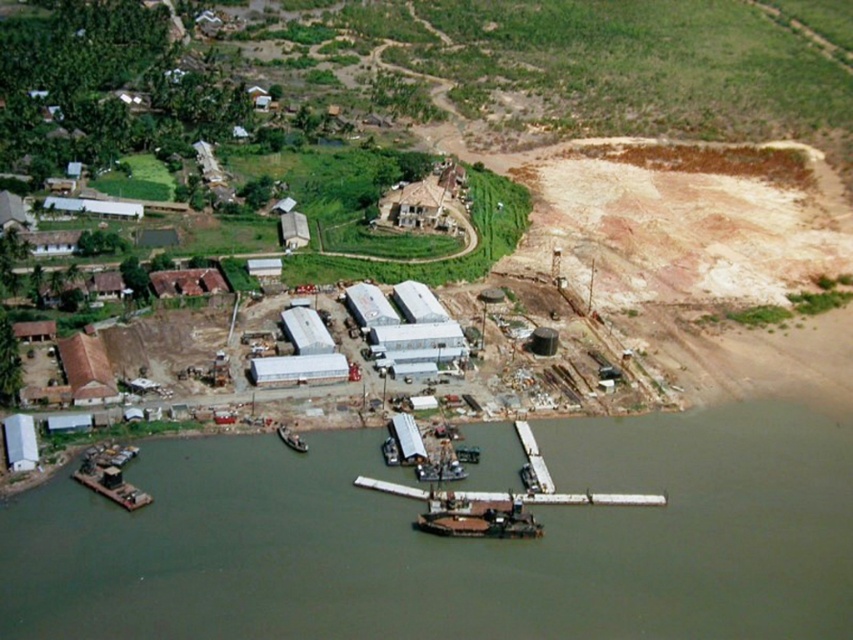
Can you confirm if metallic gray barge at lower center is taller than wooden dock at lower center?

In fact, metallic gray barge at lower center may be shorter than wooden dock at lower center.

Is point (418, 525) farther from viewer compared to point (526, 477)?

No.

Where is `metallic gray barge at lower center`? This screenshot has height=640, width=853. metallic gray barge at lower center is located at coordinates (479, 520).

In the scene shown: Does brown muddy water at lower center appear over wooden dock at lower center?

Actually, brown muddy water at lower center is below wooden dock at lower center.

What do you see at coordinates (451, 541) in the screenshot? This screenshot has height=640, width=853. I see `brown muddy water at lower center` at bounding box center [451, 541].

You are a GUI agent. You are given a task and a screenshot of the screen. Output one action in this format:
    pyautogui.click(x=<x>, y=<y>)
    Task: Click on the brown muddy water at lower center
    This screenshot has width=853, height=640.
    Given the screenshot: What is the action you would take?
    click(451, 541)

How distant is wooden dock at lower center from metallic gray boat at lower center?

wooden dock at lower center is 108.99 feet away from metallic gray boat at lower center.

This screenshot has height=640, width=853. I want to click on wooden dock at lower center, so click(x=532, y=461).

Where is `wooden dock at lower center`? wooden dock at lower center is located at coordinates (532, 461).